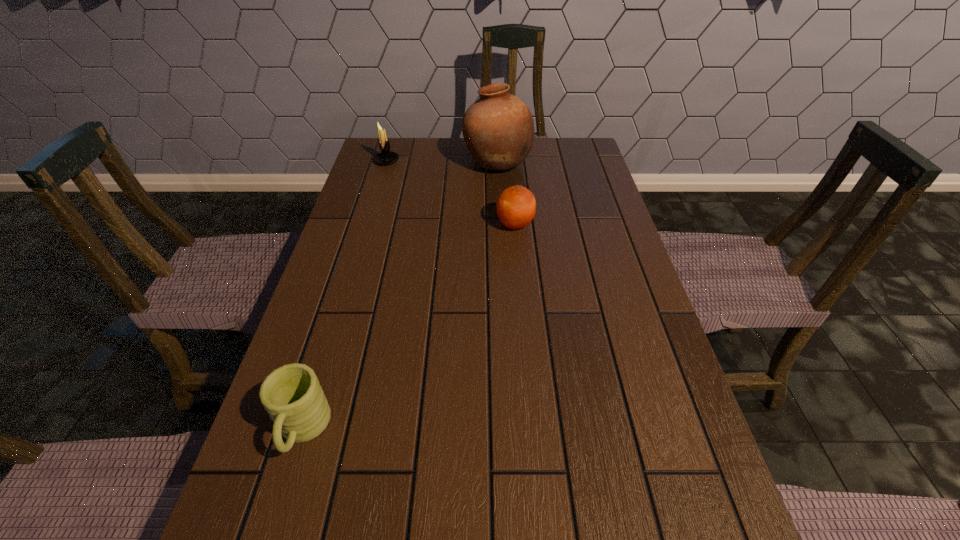
This screenshot has width=960, height=540. I want to click on candle holder located at the left edge, so click(x=385, y=157).

The height and width of the screenshot is (540, 960). What are the coordinates of `mug situated at the left edge` in the screenshot? It's located at (291, 394).

The width and height of the screenshot is (960, 540). Find the location of `object that is at the far left corner`. object that is at the far left corner is located at coordinates (385, 157).

This screenshot has width=960, height=540. In order to click on vacant area at the far edge of the desktop in this screenshot , I will do (460, 143).

You are a GUI agent. You are given a task and a screenshot of the screen. Output one action in this format:
    pyautogui.click(x=<x>, y=<y>)
    Task: Click on the vacant area at the left edge of the desktop
    
    Given the screenshot: What is the action you would take?
    pyautogui.click(x=389, y=260)

This screenshot has width=960, height=540. In the image, there is a desktop. Identify the location of vacant space at the right edge. (588, 312).

I want to click on free spot between the candle holder and the orange, so click(x=451, y=193).

Locate an element on the screen. This screenshot has width=960, height=540. vacant region between the nearest object and the candle holder is located at coordinates (345, 295).

Where is `free space between the candle holder and the second nearest object`? The image size is (960, 540). free space between the candle holder and the second nearest object is located at coordinates coord(451,193).

Find the location of `free space between the tallest object and the candle holder`. free space between the tallest object and the candle holder is located at coordinates (442, 162).